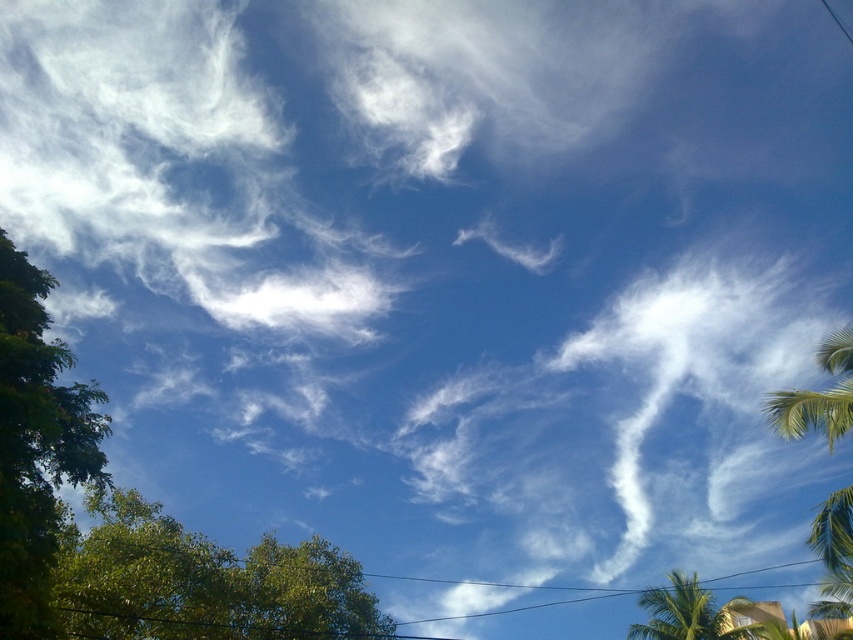
Between point (94, 620) and point (851, 536), which one is positioned behind?

Positioned behind is point (94, 620).

Between green leafy tree at lower left and green leafy palm tree at right, which one has less height?

With less height is green leafy tree at lower left.

Who is more forward, (96, 561) or (799, 397)?

Point (799, 397) is more forward.

Locate an element on the screen. green leafy tree at lower left is located at coordinates (202, 582).

Is point (57, 397) less distant than point (840, 508)?

Yes.

Is green leafy tree at left above green leafy palm tree at right?

Correct, green leafy tree at left is located above green leafy palm tree at right.

Which is behind, point (41, 298) or point (831, 506)?

Point (831, 506)

The height and width of the screenshot is (640, 853). I want to click on green leafy tree at left, so click(x=36, y=445).

Is green leafy tree at lower left to the left of green leafy tree at left from the viewer's perspective?

Incorrect, green leafy tree at lower left is not on the left side of green leafy tree at left.

Which is more to the right, green leafy tree at lower left or green leafy tree at left?

green leafy tree at lower left

Which is behind, point (154, 616) or point (91, 388)?

The point (154, 616) is behind.

In order to click on green leafy tree at lower left in this screenshot , I will do `click(202, 582)`.